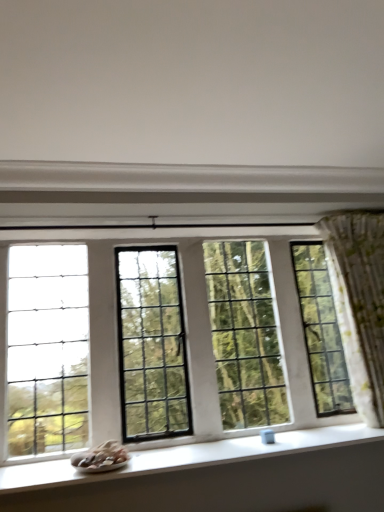
Question: Looking at their shapes, would you say green floral fabric curtain at right is wider or thinner than clear glass window at center?

Choices:
 (A) thin
 (B) wide

Answer: (B)

Question: From a real-world perspective, relative to clear glass window at center, is green floral fabric curtain at right vertically above or below?

Choices:
 (A) above
 (B) below

Answer: (B)

Question: Estimate the real-world distances between objects in this image. Which object is closer to the white smooth window sill at lower center?

Choices:
 (A) white matte wall at upper center
 (B) clear glass window at center
 (C) green floral fabric curtain at right

Answer: (B)

Question: Considering the real-world distances, which object is closest to the clear glass window at center?

Choices:
 (A) white smooth window sill at lower center
 (B) green floral fabric curtain at right
 (C) white matte wall at upper center

Answer: (A)